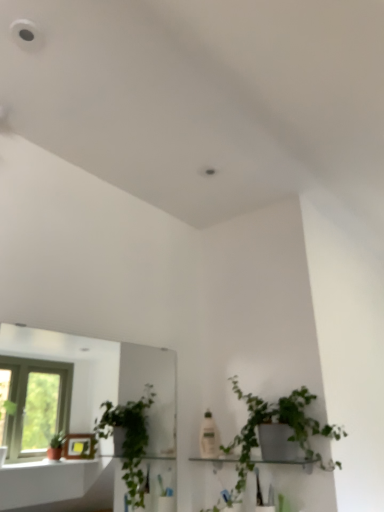
Question: Is clear glass mirror at left bigger or smaller than white glossy shelf at center?

Choices:
 (A) small
 (B) big

Answer: (B)

Question: Based on their positions, is clear glass mirror at left located to the left or right of white glossy shelf at center?

Choices:
 (A) right
 (B) left

Answer: (B)

Question: Which of these objects is positioned farthest from the clear glass mirror at left?

Choices:
 (A) green matte plant at center-right
 (B) white glossy shelf at center

Answer: (B)

Question: Estimate the real-world distances between objects in this image. Which object is closer to the white glossy shelf at center?

Choices:
 (A) clear glass mirror at left
 (B) green matte plant at center-right

Answer: (B)